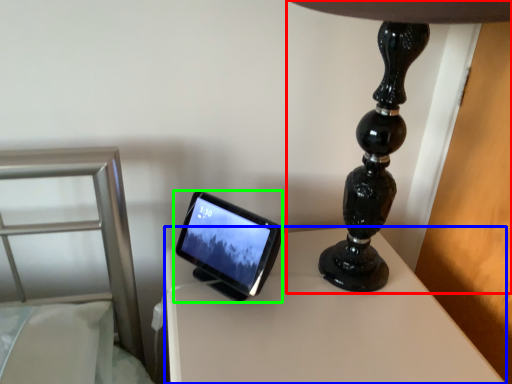
Question: Based on their relative distances, which object is nearer to lamp (highlighted by a red box)? Choose from table (highlighted by a blue box) and tablet computer (highlighted by a green box).

Choices:
 (A) table
 (B) tablet computer

Answer: (A)